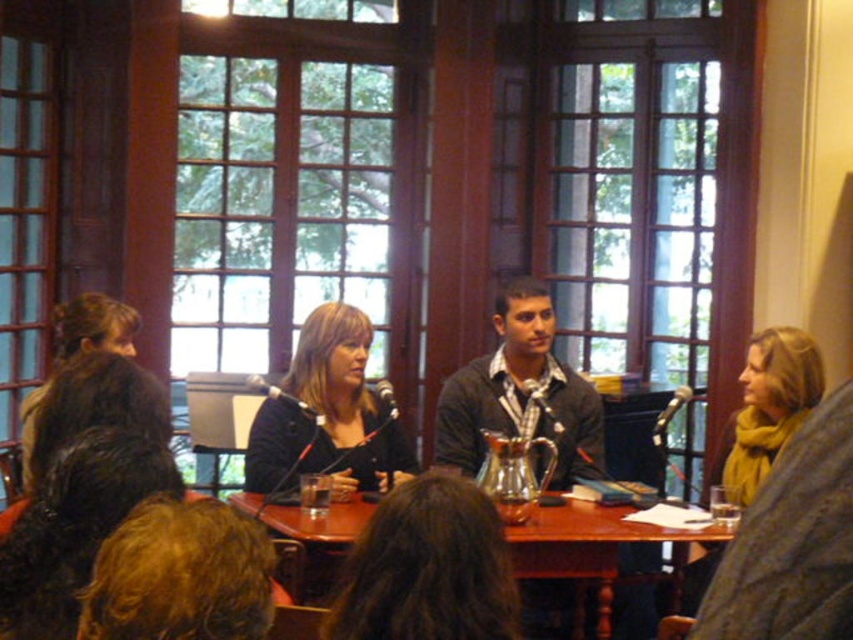
Is matte black pitcher at center shorter than wooden table at center?

Correct, matte black pitcher at center is not as tall as wooden table at center.

Does point (413, 630) lie behind point (613, 550)?

No, (413, 630) is closer to viewer.

Measure the distance between point (x=349, y=573) and camera.

They are 2.32 meters apart.

You are a GUI agent. You are given a task and a screenshot of the screen. Output one action in this format:
    pyautogui.click(x=<x>, y=<y>)
    Task: Click on the matte black pitcher at center
    This screenshot has height=640, width=853.
    Given the screenshot: What is the action you would take?
    pyautogui.click(x=428, y=568)

Which is in front, point (598, 428) or point (364, 339)?

Point (364, 339) is in front.

Can you confirm if dark gray sweater at center is taller than matte black jacket at center?

Indeed, dark gray sweater at center has a greater height compared to matte black jacket at center.

This screenshot has width=853, height=640. In order to click on dark gray sweater at center in this screenshot , I will do `click(521, 394)`.

Between point (440, 490) and point (751, 480), which one is positioned behind?

The point (751, 480) is behind.

Describe the element at coordinates (428, 568) in the screenshot. Image resolution: width=853 pixels, height=640 pixels. I see `matte black pitcher at center` at that location.

Find the location of `matte black pitcher at center`. matte black pitcher at center is located at coordinates (428, 568).